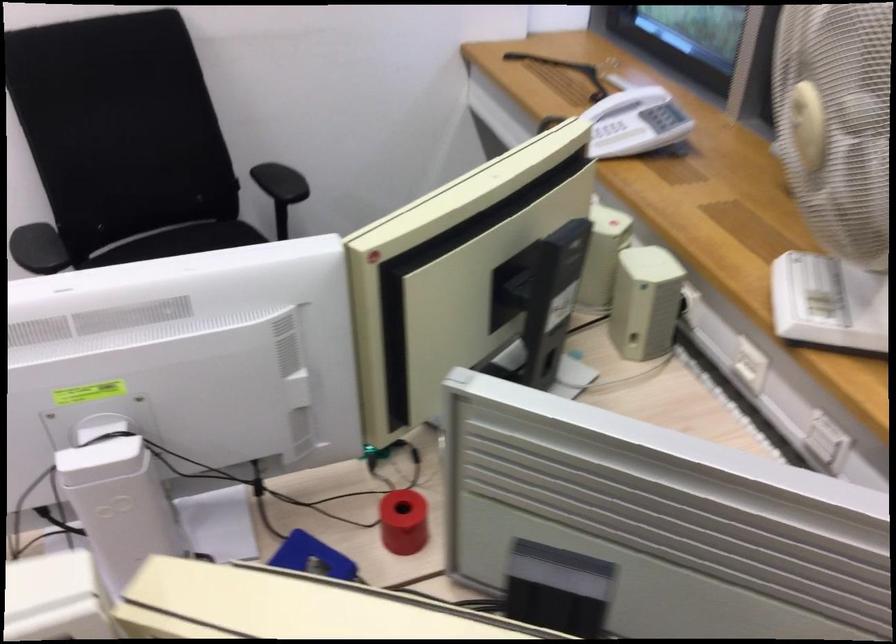
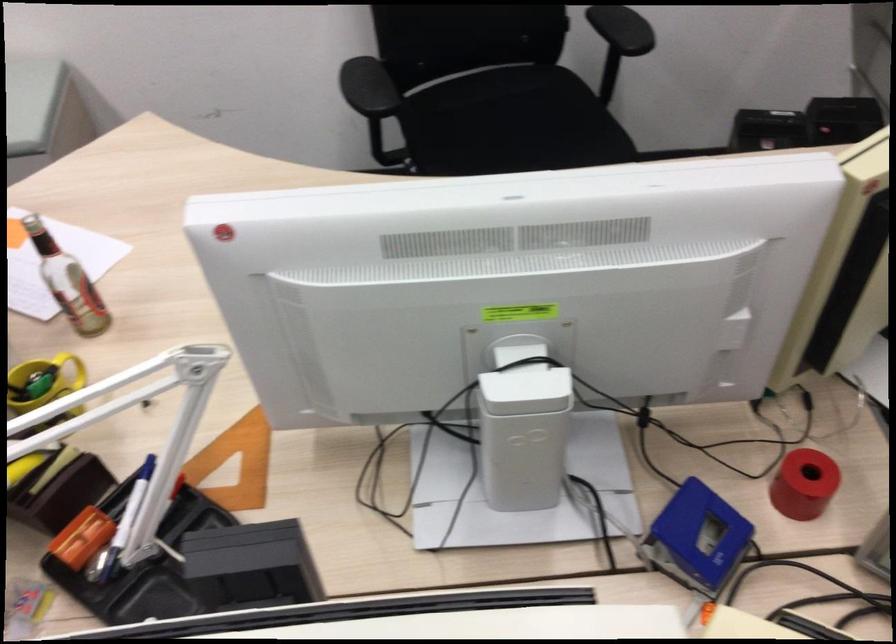
In a continuous first-person perspective shot, in which direction is the camera moving?

The cameraman walked toward left, forward.